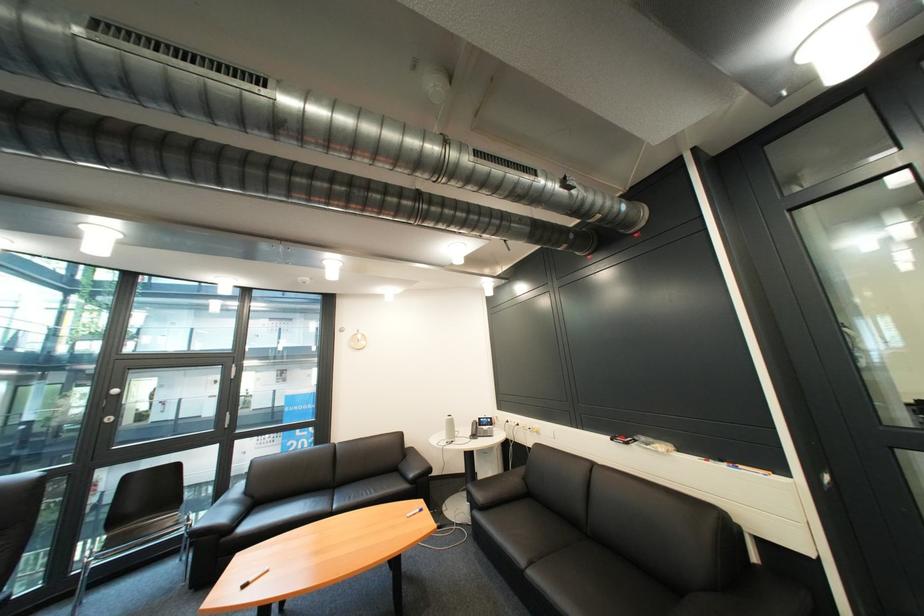
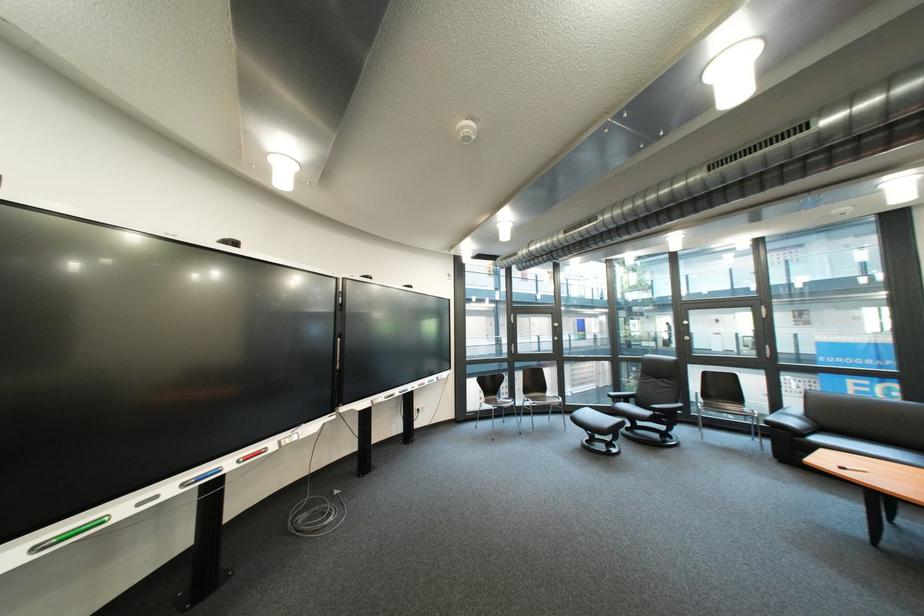
Where in the second image is the point corresponding to point 260,495 from the first image?

(822, 418)